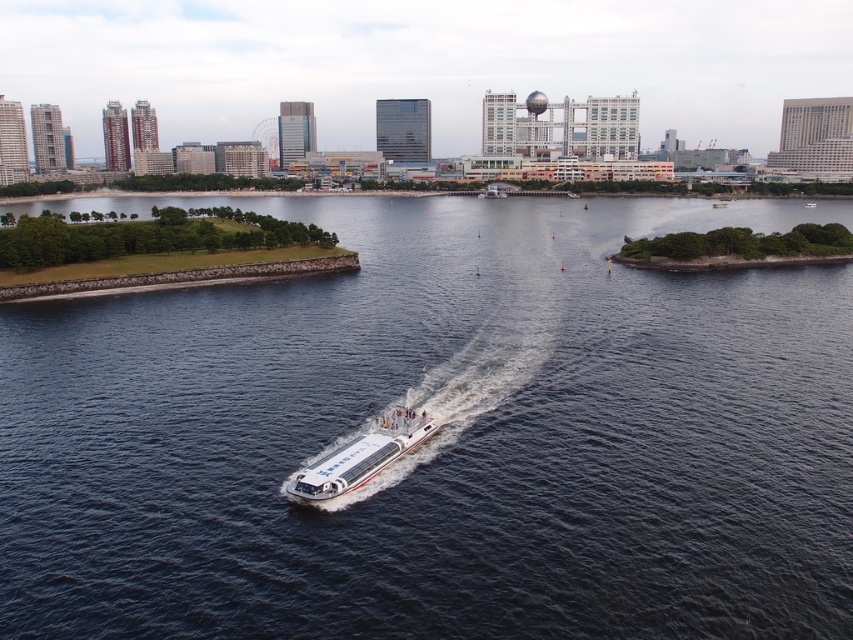
You are standing at the point marked as point (477, 518) in the urban waterfront scene. You want to take a photo of the white and red ferry boat with the highrise buildings in the background. Can you capture both the ferry boat and the highrise buildings in the same frame without moving your position?

Yes, you can capture both the white and red ferry boat and the highrise buildings in the same frame without moving your position because the point (477, 518) is positioned such that the ferry boat and the highrise buildings are within the camera view. The distance between the point and the camera is 102.24 feet, which allows for a wide enough angle to include both the foreground ferry and the background buildings in the composition.

You are a photographer planning to capture the entire scene from this vantage point. Given the dark blue water at center and the white glossy boat at center, which object will occupy more space in your photo?

The dark blue water at center is bigger than the white glossy boat at center, so it will occupy more space in the photo.